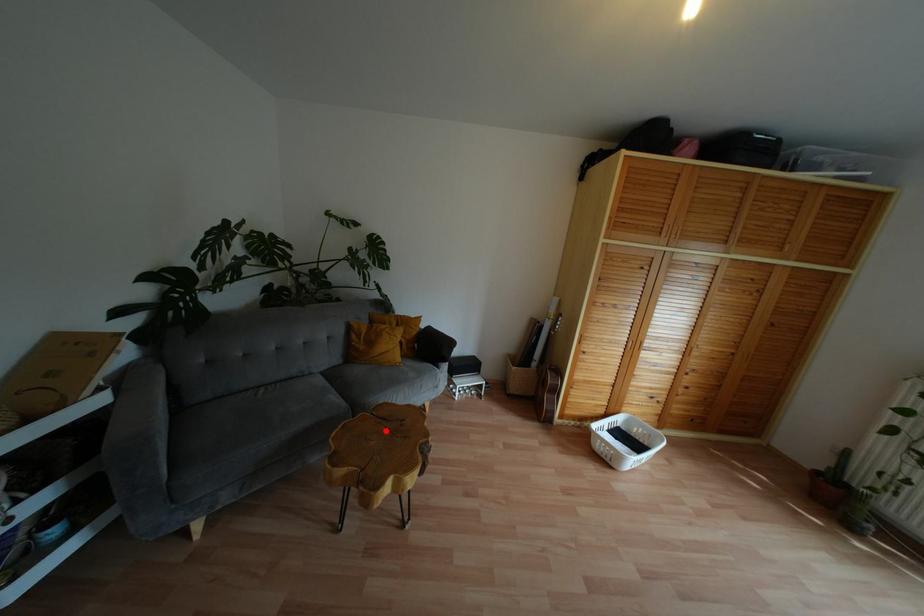
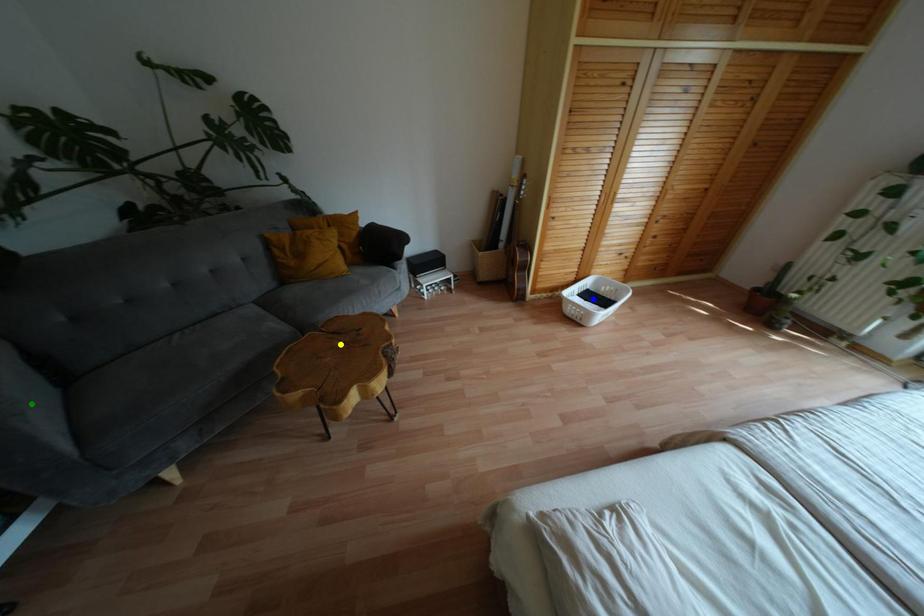
Question: I am providing you with two images of the same scene from different viewpoints. A red point is marked on the first image. You are given multiple points on the second image. Can you choose the point in image 2 that corresponds to the point in image 1?

Choices:
 (A) green point
 (B) blue point
 (C) yellow point

Answer: (C)